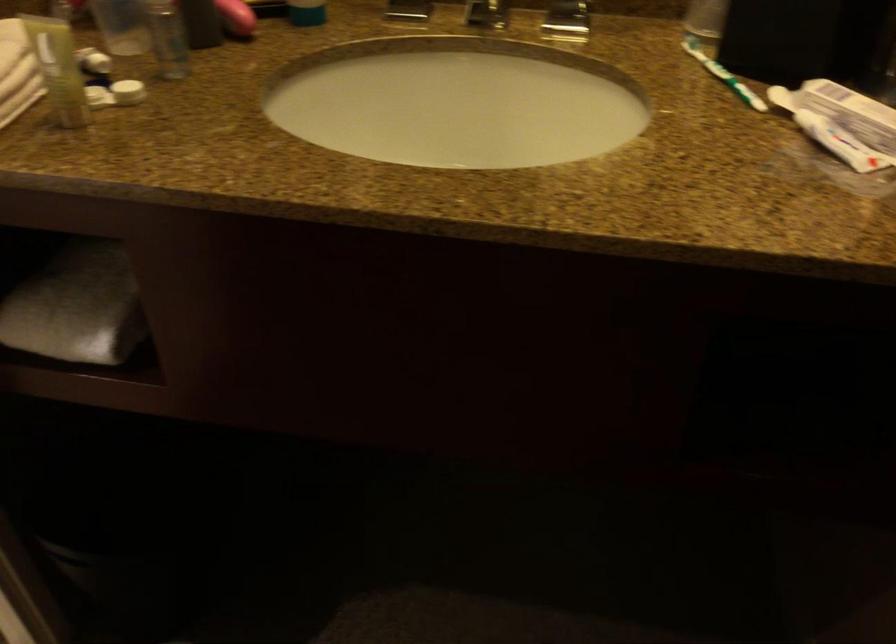
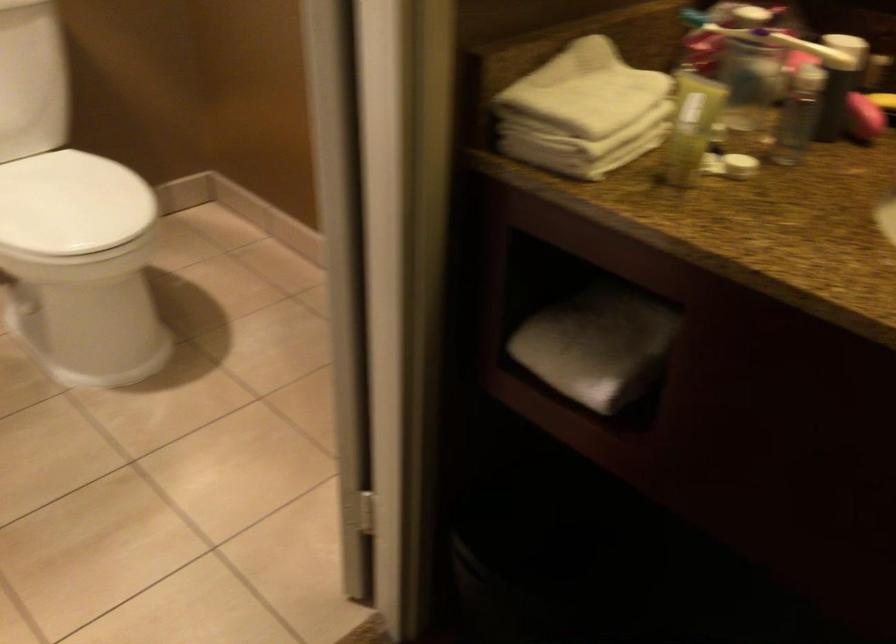
Question: The images are taken continuously from a first-person perspective. In which direction is your viewpoint rotating?

Choices:
 (A) Left
 (B) Right
 (C) Up
 (D) Down

Answer: (A)